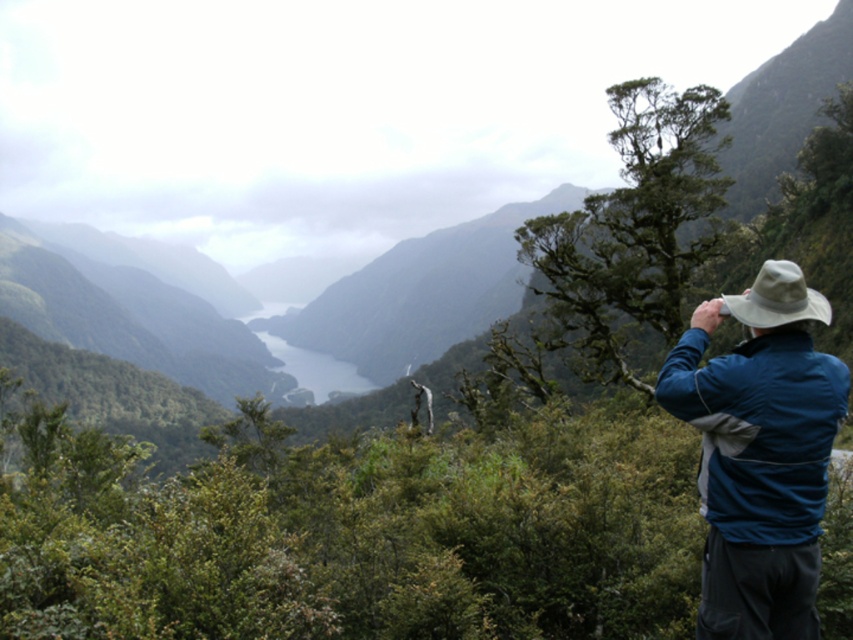
Question: Is green leafy shrubs at center to the right of beige fabric hat at upper right from the viewer's perspective?

Choices:
 (A) no
 (B) yes

Answer: (B)

Question: Where is beige fabric hat at upper right located in relation to gray/smooth lake at center in the image?

Choices:
 (A) below
 (B) above

Answer: (B)

Question: Which point is farther to the camera?

Choices:
 (A) (302, 362)
 (B) (712, 422)
 (C) (669, 550)

Answer: (A)

Question: Considering the real-world distances, which object is farthest from the blue fabric jacket at right?

Choices:
 (A) beige fabric hat at upper right
 (B) gray/smooth lake at center

Answer: (B)

Question: Does blue fabric jacket at right come behind beige fabric hat at upper right?

Choices:
 (A) yes
 (B) no

Answer: (B)

Question: Which point is closer to the camera?

Choices:
 (A) blue fabric jacket at right
 (B) beige fabric hat at upper right
 (C) green leafy shrubs at center

Answer: (A)